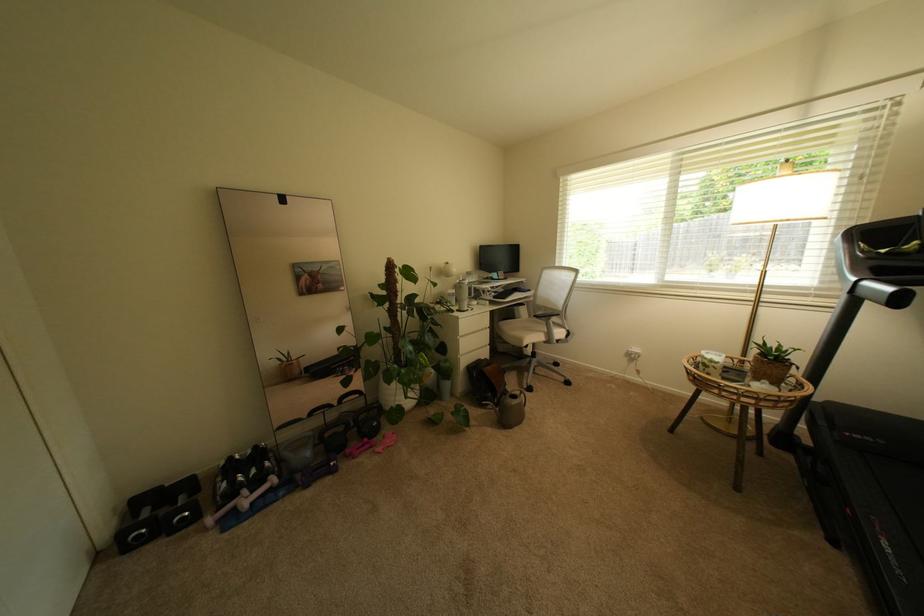
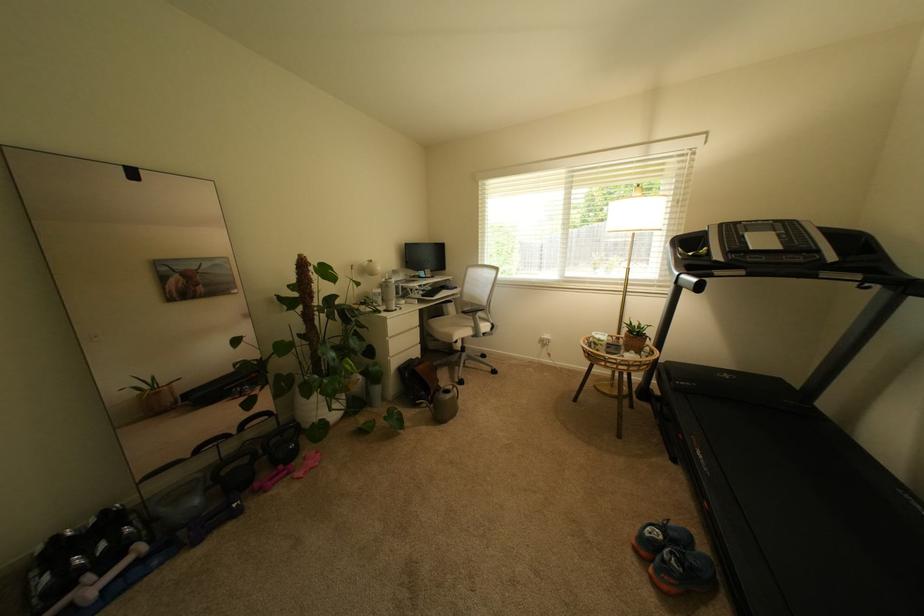
The point at (261, 493) is marked in the first image. Where is the corresponding point in the second image?

(111, 573)